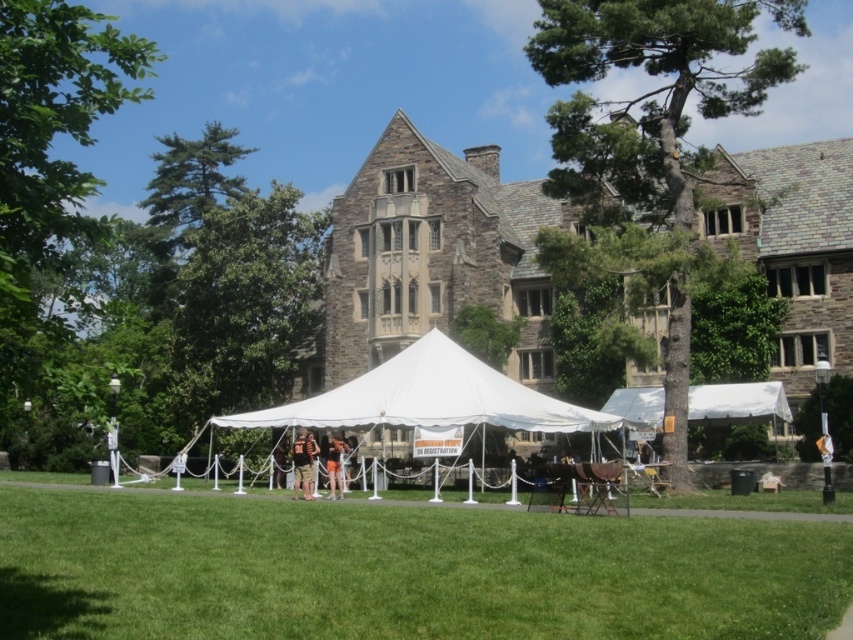
Between camouflage fabric shirt at center and orange fabric tent at center, which one is positioned lower?

orange fabric tent at center is lower down.

Between camouflage fabric shirt at center and orange fabric tent at center, which one appears on the right side from the viewer's perspective?

From the viewer's perspective, orange fabric tent at center appears more on the right side.

Between point (310, 460) and point (340, 468), which one is positioned in front?

Positioned in front is point (310, 460).

Where is `camouflage fabric shirt at center`? Image resolution: width=853 pixels, height=640 pixels. camouflage fabric shirt at center is located at coordinates click(303, 464).

Is green grass at lower center wider than white fabric tent at center?

Correct, the width of green grass at lower center exceeds that of white fabric tent at center.

Can you confirm if green grass at lower center is positioned below white fabric tent at center?

Yes, green grass at lower center is below white fabric tent at center.

The width and height of the screenshot is (853, 640). What are the coordinates of `green grass at lower center` in the screenshot? It's located at (402, 572).

Is white fabric tent at center above camouflage fabric shirt at center?

Correct, white fabric tent at center is located above camouflage fabric shirt at center.

Find the location of a particular element. Image resolution: width=853 pixels, height=640 pixels. white fabric tent at center is located at coordinates (428, 397).